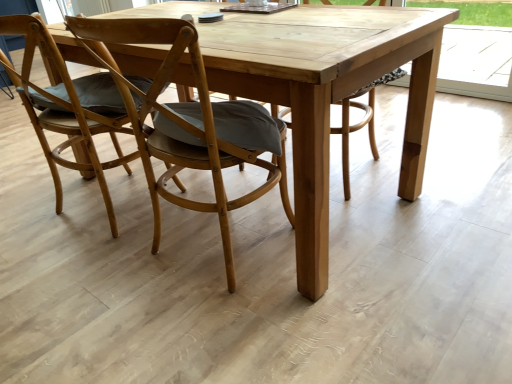
You are a GUI agent. You are given a task and a screenshot of the screen. Output one action in this format:
    pyautogui.click(x=<x>, y=<y>)
    Task: Click on the unoccupied region to the right of natural wood picnic table at center
    
    Given the screenshot: What is the action you would take?
    pyautogui.click(x=448, y=163)